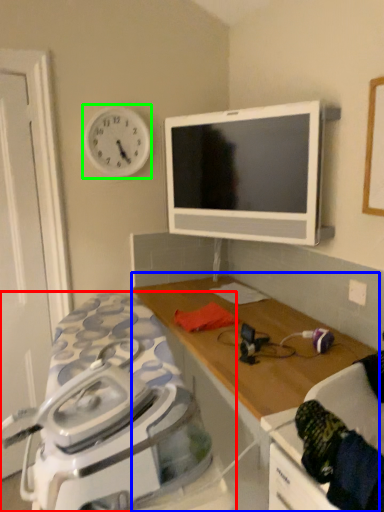
Question: Estimate the real-world distances between objects in this image. Which object is farther from home appliance (highlighted by a red box), table (highlighted by a blue box) or clock (highlighted by a green box)?

Choices:
 (A) table
 (B) clock

Answer: (B)